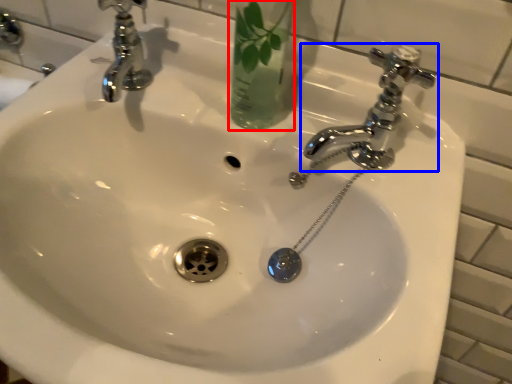
Question: Which of the following is the farthest to the observer, glass vase (highlighted by a red box) or tap (highlighted by a blue box)?

Choices:
 (A) glass vase
 (B) tap

Answer: (B)